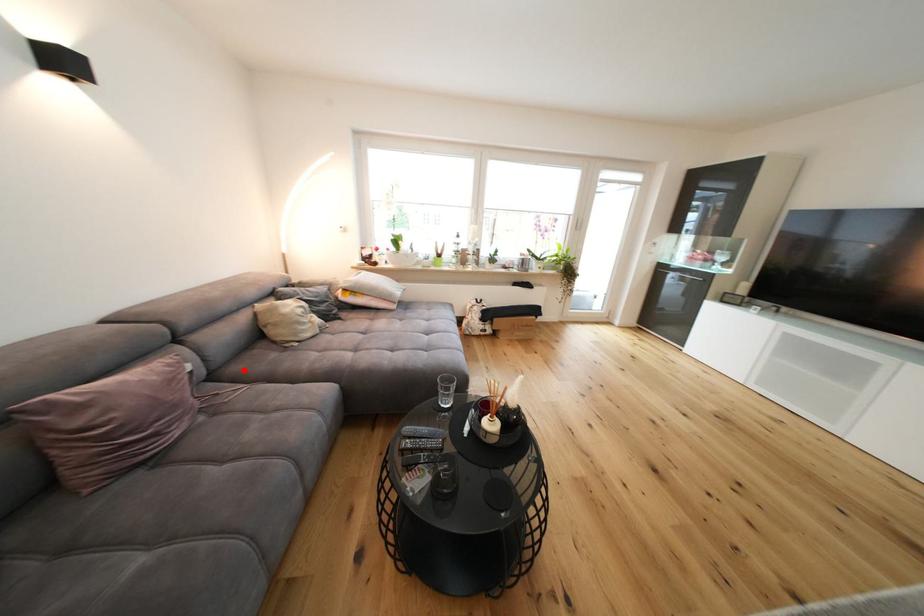
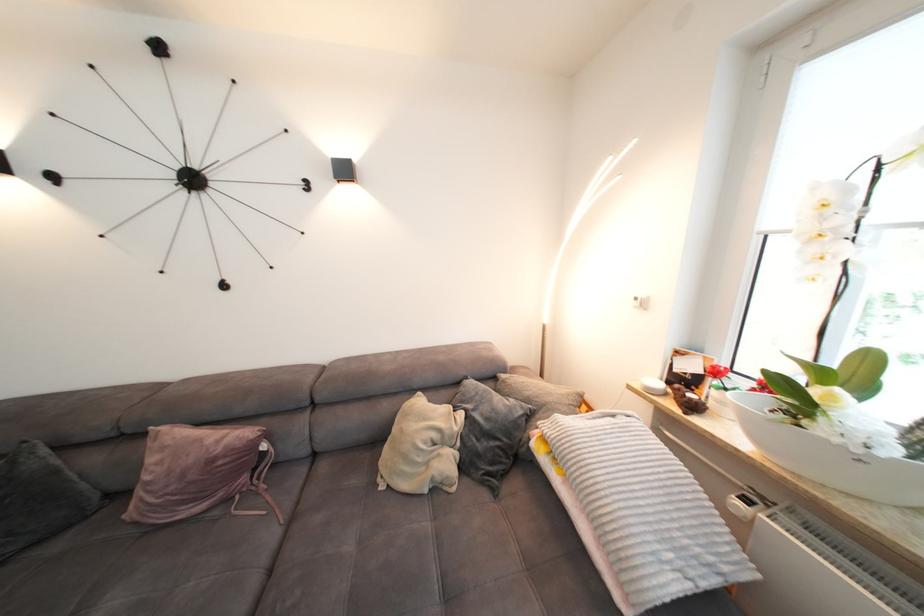
Locate, in the second image, the point that corresponds to the highlighted location in the first image.

(330, 469)